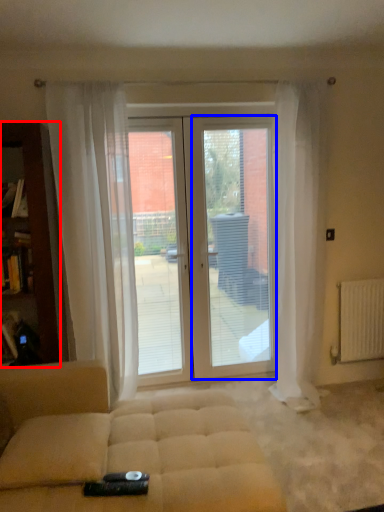
Question: Which of the following is the farthest to the observer, cabinetry (highlighted by a red box) or screen door (highlighted by a blue box)?

Choices:
 (A) cabinetry
 (B) screen door

Answer: (B)